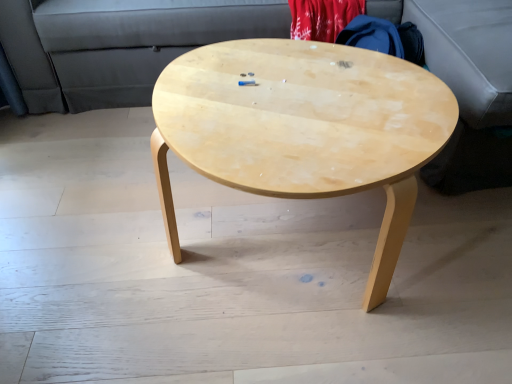
At what (x,y) coordinates should I click in order to perform the action: click on free spot below natural wood coffee table at center (from a real-world perspective). Please return your answer as a coordinate pair (x, y). This screenshot has width=512, height=384. Looking at the image, I should click on (282, 254).